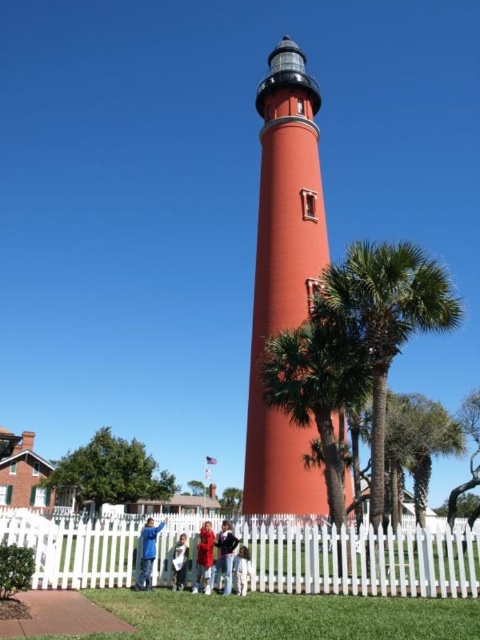
Who is more distant from viewer, (144, 570) or (223, 554)?

Positioned behind is point (223, 554).

Who is taller, blue denim jacket at lower center or red fabric coat at center?

With more height is blue denim jacket at lower center.

Identify the location of blue denim jacket at lower center. (147, 552).

Identify the location of blue denim jacket at lower center. 147,552.

Is white picket fence at lower center bigger than white cotton pants at lower center?

Correct, white picket fence at lower center is larger in size than white cotton pants at lower center.

Between white picket fence at lower center and white cotton pants at lower center, which one is positioned higher?

white cotton pants at lower center is above.

Between point (264, 550) and point (244, 576), which one is positioned behind?

The point (264, 550) is more distant.

Find the location of a particular element. white picket fence at lower center is located at coordinates (361, 560).

Is point (237, 552) in front of point (175, 582)?

No.

Does white cotton pants at lower center have a greater width compared to red velvet coat at lower center?

Yes.

Image resolution: width=480 pixels, height=640 pixels. I want to click on white cotton pants at lower center, so click(241, 570).